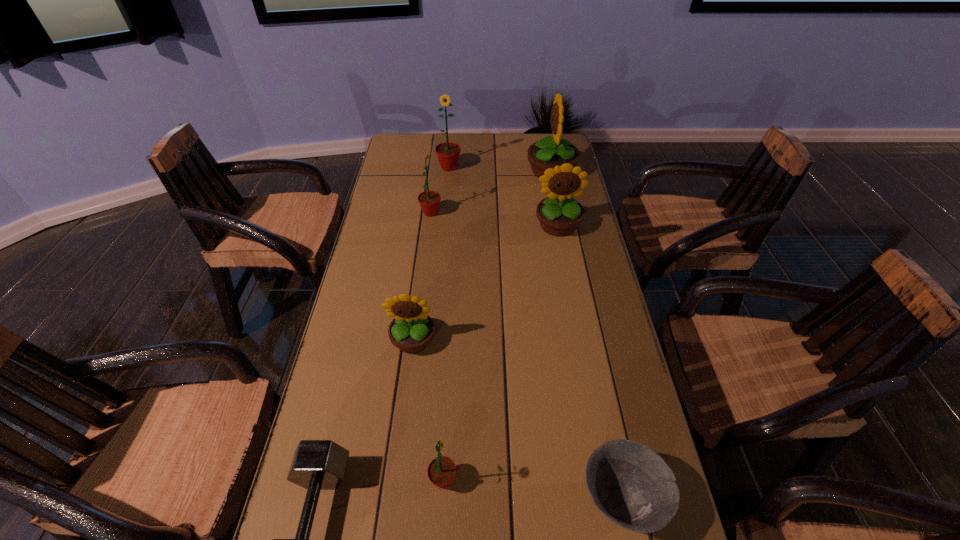
This screenshot has height=540, width=960. In the image, there is a desktop. Identify the location of free space at the far left corner. (408, 150).

Where is `vacant space that's between the smallest yellow sunflower and the second smallest green sunflower`? vacant space that's between the smallest yellow sunflower and the second smallest green sunflower is located at coordinates (421, 276).

I want to click on free space between the leftmost yellow sunflower and the second nearest green sunflower, so click(x=421, y=276).

This screenshot has height=540, width=960. Identify the location of unoccupied position between the second nearest yellow sunflower and the second nearest sunflower. (485, 282).

In order to click on free space that is in between the second farthest yellow sunflower and the farthest green sunflower in this screenshot , I will do `click(503, 197)`.

Locate an element on the screen. This screenshot has width=960, height=540. empty location between the nearest green sunflower and the farthest yellow sunflower is located at coordinates (497, 325).

Locate an element on the screen. This screenshot has width=960, height=540. free spot between the second smallest green sunflower and the farthest yellow sunflower is located at coordinates (491, 192).

Identify the location of vacant area that lies between the nearest green sunflower and the second nearest green sunflower. The height and width of the screenshot is (540, 960). (437, 347).

This screenshot has height=540, width=960. Find the location of `object identified as the seventh closest to the second biggest yellow sunflower`. object identified as the seventh closest to the second biggest yellow sunflower is located at coordinates (317, 464).

Select which object is the fourth closest to the second biggest yellow sunflower. Please provide its 2D coordinates. Your answer should be formatted as a tuple, i.e. [(x, y)], where the tuple contains the x and y coordinates of a point satisfying the conditions above.

[(411, 330)]